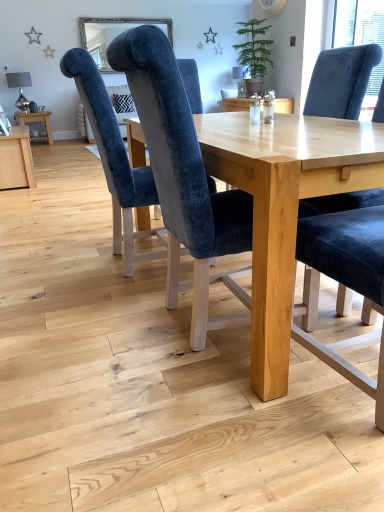
Image resolution: width=384 pixels, height=512 pixels. What are the coordinates of `vacant position to the left of velvet blue chair at center, positioned as the 2th chair in right-to-left order` in the screenshot? It's located at (90, 331).